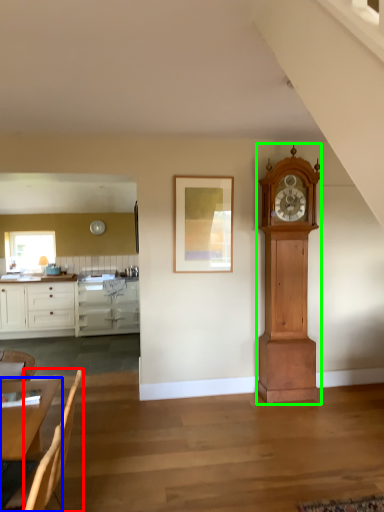
Question: Which object is the farthest from armchair (highlighted by a red box)? Choose among these: table (highlighted by a blue box) or wall clock (highlighted by a green box).

Choices:
 (A) table
 (B) wall clock

Answer: (B)